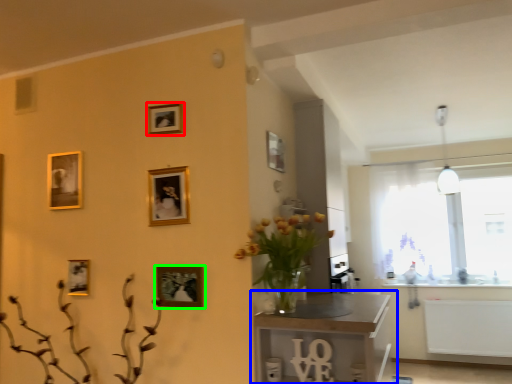
Question: Which object is positioned farthest from picture frame (highlighted by a red box)? Select from table (highlighted by a blue box) and picture frame (highlighted by a green box).

Choices:
 (A) table
 (B) picture frame

Answer: (A)